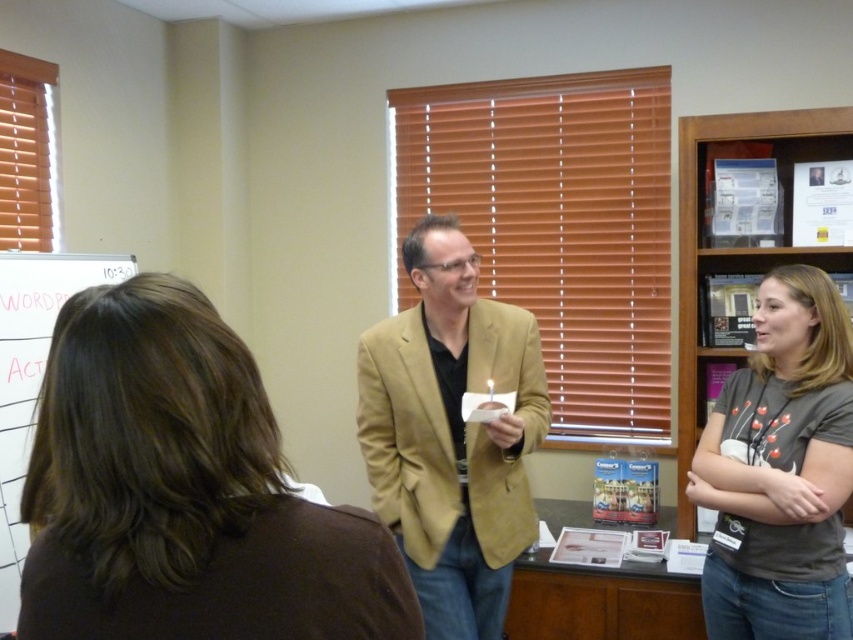
Looking at this image, measure the distance between point (781, 280) and camera.

6.34 feet

You are a GUI agent. You are given a task and a screenshot of the screen. Output one action in this format:
    pyautogui.click(x=<x>, y=<y>)
    Task: Click on the gray cotton t-shirt at center right
    
    Given the screenshot: What is the action you would take?
    pyautogui.click(x=781, y=470)

Which of these two, matte gold blazer at center or white grid paper at upper left, stands shorter?

Standing shorter between the two is white grid paper at upper left.

Between matte gold blazer at center and white grid paper at upper left, which one is positioned higher?

Positioned higher is white grid paper at upper left.

Identify the location of matte gold blazer at center. (451, 433).

Between brown fabric hair at left and gray cotton t-shirt at center right, which one has more height?

Standing taller between the two is gray cotton t-shirt at center right.

Is point (42, 552) closer to viewer compared to point (813, 579)?

Yes, point (42, 552) is in front of point (813, 579).

What do you see at coordinates (189, 493) in the screenshot? The image size is (853, 640). I see `brown fabric hair at left` at bounding box center [189, 493].

I want to click on brown fabric hair at left, so [x=189, y=493].